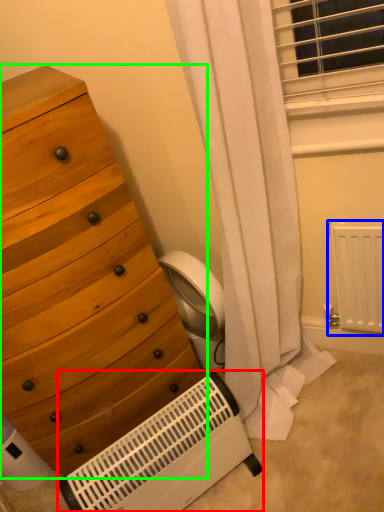
Question: Which object is the closest to the heater (highlighted by a red box)? Choose among these: radiator (highlighted by a blue box) or chest of drawers (highlighted by a green box).

Choices:
 (A) radiator
 (B) chest of drawers

Answer: (B)